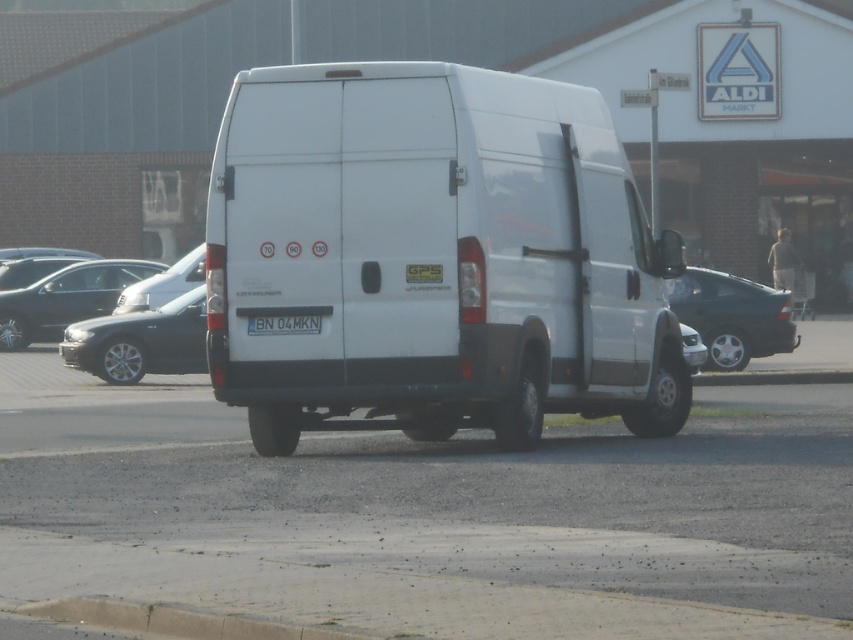
You are a delivery person who needs to unload a package from the gray concrete curb at lower center onto the satin silver sedan at center. Considering their heights, will you need a ramp or stairs to move the package from the curb to the sedan?

The gray concrete curb at lower center has a lesser height compared to the satin silver sedan at center, so you will not need a ramp or stairs to move the package from the curb to the sedan.

You are standing in front of the white van parked near the Aldi Market. There are two points marked on the van. Which point is closer to you, point (318, 211) or point (47, 273)?

Point (318, 211) is closer to you than point (47, 273).